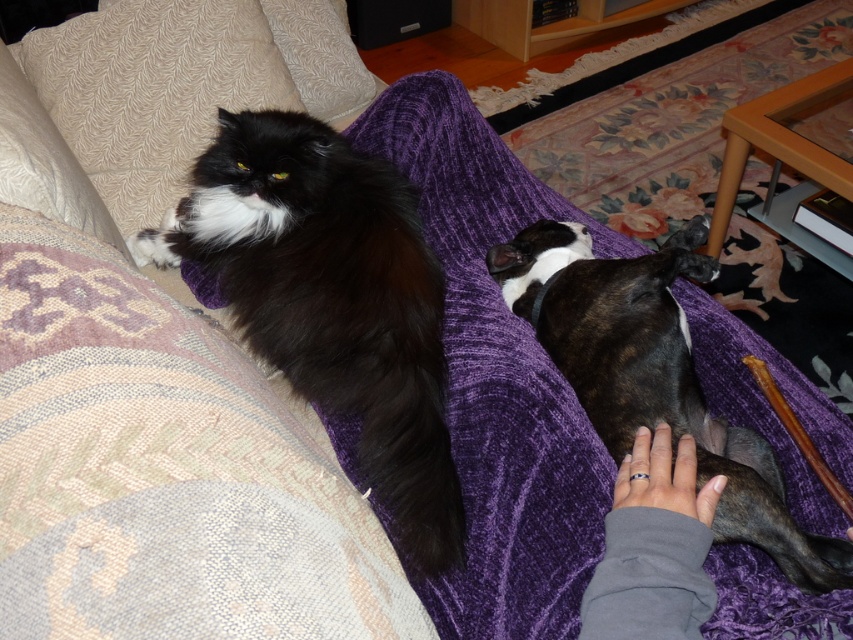
You are standing at the center of the couch and looking towards the purple blanket. There are two points marked on the blanket. The first point is at point (625,394) and the second point is at point (35,209). Which point is closer to you?

Point (625,394) is in front of point (35,209), so it is closer to you.

You are a pet sitter who needs to place a 12 inch long toy between the black fluffy cat at upper left and the brindle fur dog at lower right. Will the toy fit between them without overlapping either animal?

The distance between the black fluffy cat at upper left and the brindle fur dog at lower right is 11.18 inches. Since the toy is 12 inches long, it will not fit between them without overlapping either animal.